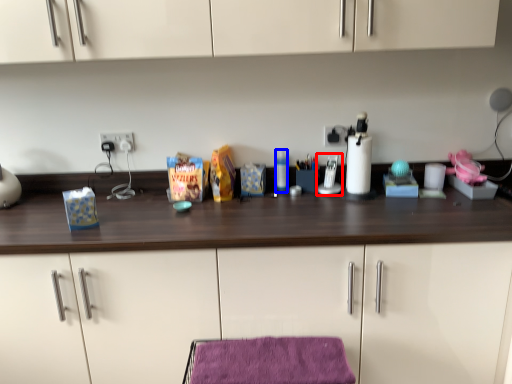
Question: Among these objects, which one is nearest to the camera, appliance (highlighted by a red box) or bottle (highlighted by a blue box)?

Choices:
 (A) appliance
 (B) bottle

Answer: (A)